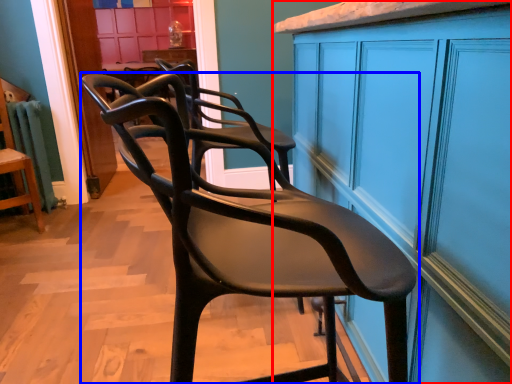
Question: Which object is closer to the camera taking this photo, cabinetry (highlighted by a red box) or chair (highlighted by a blue box)?

Choices:
 (A) cabinetry
 (B) chair

Answer: (A)